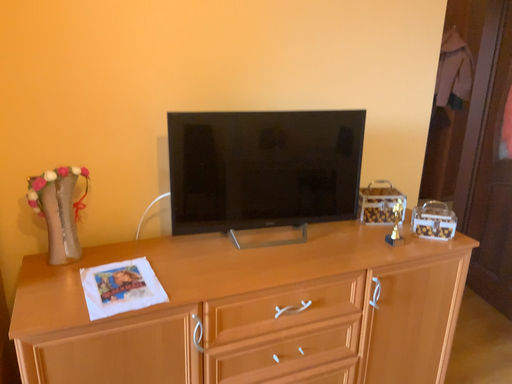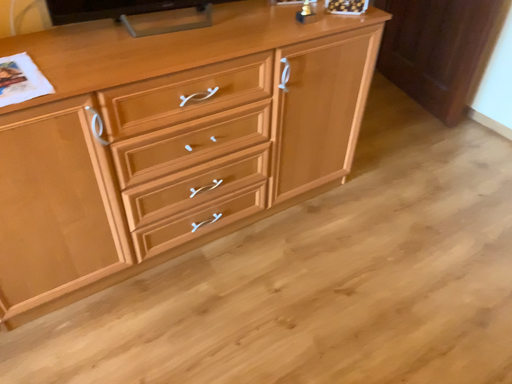
Question: How did the camera likely rotate when shooting the video?

Choices:
 (A) rotated upward
 (B) rotated downward

Answer: (B)